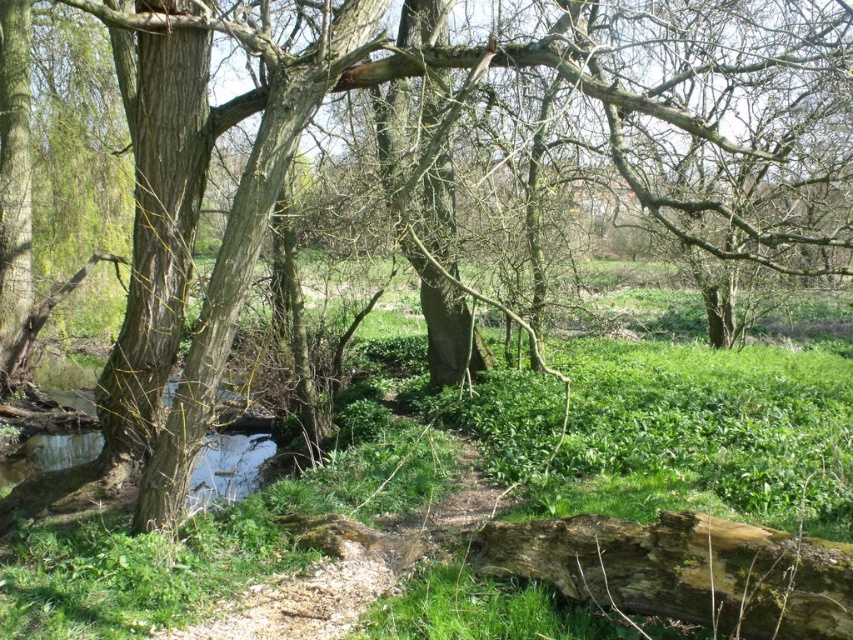
Question: Is green leafy grass at center to the right of smooth bark tree trunk at left from the viewer's perspective?

Choices:
 (A) no
 (B) yes

Answer: (B)

Question: Which point appears closest to the camera in this image?

Choices:
 (A) (161, 369)
 (B) (630, 451)

Answer: (A)

Question: Which of the following is the farthest from the observer?

Choices:
 (A) smooth bark tree trunk at left
 (B) green leafy grass at center

Answer: (A)

Question: Does green leafy grass at center have a greater width compared to smooth bark tree trunk at left?

Choices:
 (A) no
 (B) yes

Answer: (B)

Question: Among these points, which one is farthest from the camera?

Choices:
 (A) (160, 182)
 (B) (599, 636)

Answer: (A)

Question: Does green leafy grass at center come in front of smooth bark tree trunk at left?

Choices:
 (A) no
 (B) yes

Answer: (B)